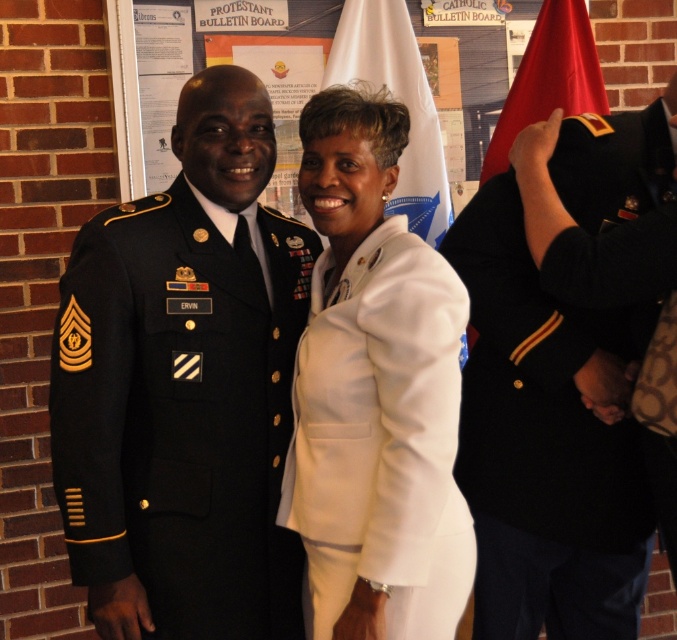
Question: Is navy blue wool military uniform at right above shiny red flag at upper right?

Choices:
 (A) no
 (B) yes

Answer: (A)

Question: From the image, what is the correct spatial relationship of navy blue wool military uniform at right in relation to white smooth suit at center?

Choices:
 (A) right
 (B) left

Answer: (A)

Question: Which object is positioned farthest from the shiny red flag at upper right?

Choices:
 (A) white fabric flag at upper center
 (B) navy blue wool military uniform at right
 (C) dark green fabric military uniform at left

Answer: (C)

Question: Does white smooth suit at center appear under shiny red flag at upper right?

Choices:
 (A) no
 (B) yes

Answer: (B)

Question: Among these objects, which one is farthest from the camera?

Choices:
 (A) white fabric flag at upper center
 (B) dark green fabric military uniform at left

Answer: (A)

Question: Which object is positioned farthest from the white fabric flag at upper center?

Choices:
 (A) white smooth suit at center
 (B) dark green fabric military uniform at left
 (C) navy blue wool military uniform at right

Answer: (B)